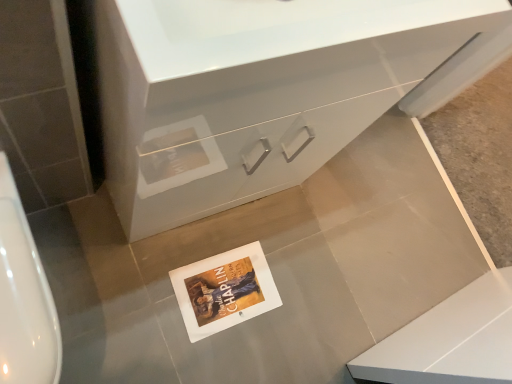
Question: From the image's perspective, is white glossy urinal at left on white paper postcard at center?

Choices:
 (A) no
 (B) yes

Answer: (B)

Question: Can you confirm if white glossy urinal at left is bigger than white paper postcard at center?

Choices:
 (A) no
 (B) yes

Answer: (B)

Question: Is white glossy urinal at left far away from white paper postcard at center?

Choices:
 (A) yes
 (B) no

Answer: (B)

Question: Is white glossy urinal at left in contact with white paper postcard at center?

Choices:
 (A) yes
 (B) no

Answer: (B)

Question: Does white glossy urinal at left have a greater height compared to white paper postcard at center?

Choices:
 (A) no
 (B) yes

Answer: (B)

Question: Based on their positions, is white glossy urinal at left located to the left or right of white glossy cabinet at center?

Choices:
 (A) right
 (B) left

Answer: (B)

Question: Is point (2, 349) closer or farther from the camera than point (168, 182)?

Choices:
 (A) farther
 (B) closer

Answer: (B)

Question: Looking at their shapes, would you say white glossy urinal at left is wider or thinner than white glossy cabinet at center?

Choices:
 (A) thin
 (B) wide

Answer: (B)

Question: From a real-world perspective, is white glossy urinal at left above or below white glossy cabinet at center?

Choices:
 (A) below
 (B) above

Answer: (A)

Question: Based on their sizes in the image, would you say white glossy urinal at left is bigger or smaller than white paper postcard at center?

Choices:
 (A) small
 (B) big

Answer: (B)

Question: Is white glossy urinal at left in front of or behind white paper postcard at center in the image?

Choices:
 (A) front
 (B) behind

Answer: (A)

Question: From the image's perspective, is white glossy urinal at left positioned above or below white paper postcard at center?

Choices:
 (A) above
 (B) below

Answer: (A)

Question: In the image, is white glossy urinal at left on the left side or the right side of white paper postcard at center?

Choices:
 (A) right
 (B) left

Answer: (B)

Question: From their relative heights in the image, would you say white paper postcard at center is taller or shorter than white glossy cabinet at center?

Choices:
 (A) tall
 (B) short

Answer: (B)

Question: Considering their positions, is white paper postcard at center located in front of or behind white glossy cabinet at center?

Choices:
 (A) front
 (B) behind

Answer: (B)